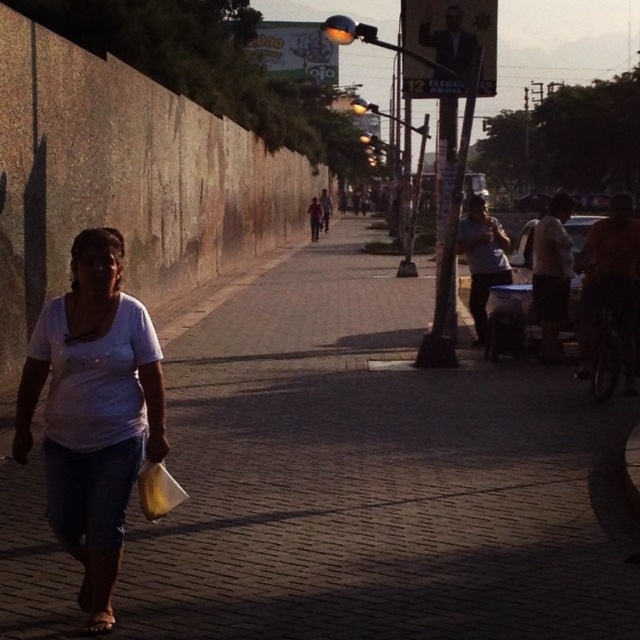
You are a pedestrian standing on the sidewalk. You see the brick pavement at center and the white matte shirt at center. Which object is closer to you?

The brick pavement at center is closer to you because the white matte shirt at center is behind it.

You are a photographer trying to capture the scene. You notice the brick pavement at center and the white matte shirt at center. Which object is shorter in the image?

The brick pavement at center is not as tall as the white matte shirt at center, so the brick pavement at center is shorter.

You are a photographer trying to capture a photo of the brick pavement at center and the white matte shirt at center. Based on their sizes, which one should you focus on to ensure it fills more of the frame?

The brick pavement at center should be focused on since its width is greater than the white matte shirt at center, making it larger in the frame.